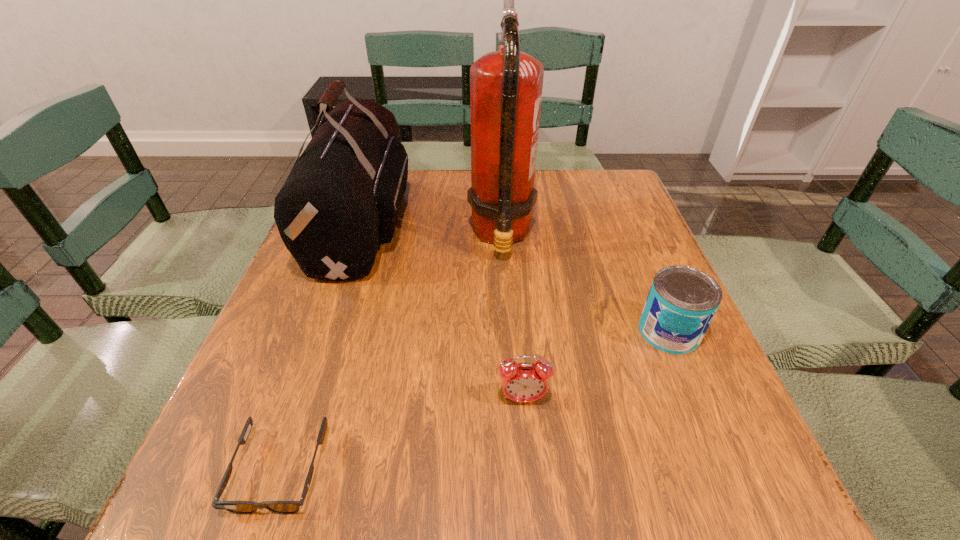
Identify the location of object that is at the near left corner. (237, 507).

This screenshot has height=540, width=960. In the image, there is a desktop. Find the location of `vacant space at the far edge`. vacant space at the far edge is located at coordinates (542, 175).

Locate an element on the screen. Image resolution: width=960 pixels, height=540 pixels. vacant space at the left edge of the desktop is located at coordinates (273, 339).

Locate an element on the screen. This screenshot has width=960, height=540. blank space at the right edge of the desktop is located at coordinates (647, 241).

Where is `free space at the far right corner of the desktop`? free space at the far right corner of the desktop is located at coordinates (599, 204).

Identify the location of empty location between the nearest object and the tallest object. (391, 353).

This screenshot has width=960, height=540. I want to click on empty location between the shortest object and the tallest object, so click(391, 353).

Where is `free point between the second nearest object and the tallest object`? free point between the second nearest object and the tallest object is located at coordinates (512, 318).

At what (x,y) coordinates should I click in order to perform the action: click on blank region between the fire extinguisher and the sunglasses. Please return your answer as a coordinate pair (x, y). Looking at the image, I should click on click(391, 353).

This screenshot has height=540, width=960. Identify the location of free space that is in between the tallest object and the duffel bag. (432, 229).